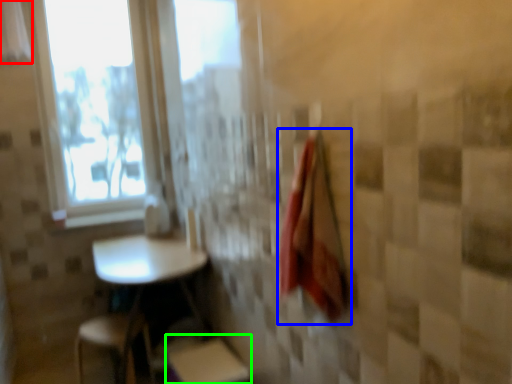
Question: Which object is positioned farthest from curtain (highlighted by a red box)? Select from bath towel (highlighted by a blue box) and step stool (highlighted by a green box).

Choices:
 (A) bath towel
 (B) step stool

Answer: (A)